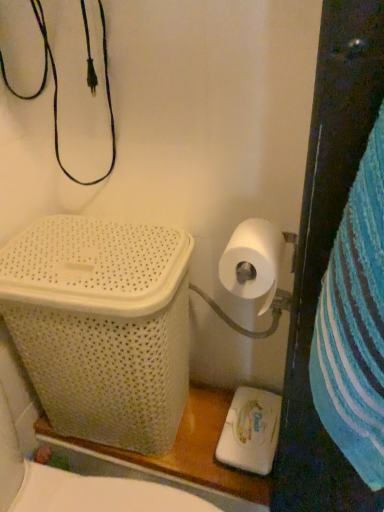
What is the approximate width of white woven laundry basket at left?

white woven laundry basket at left is 11.08 inches in width.

The height and width of the screenshot is (512, 384). What do you see at coordinates (102, 326) in the screenshot?
I see `white woven laundry basket at left` at bounding box center [102, 326].

What is the approximate height of white woven laundry basket at left?

white woven laundry basket at left is 20.69 inches tall.

You are a GUI agent. You are given a task and a screenshot of the screen. Output one action in this format:
    pyautogui.click(x=<x>, y=<y>)
    Task: Click on the white woven laundry basket at left
    
    Given the screenshot: What is the action you would take?
    pyautogui.click(x=102, y=326)

Describe the element at coordinates (253, 261) in the screenshot. I see `white matte toilet paper at right` at that location.

Identify the location of white matte toilet paper at right. (253, 261).

This screenshot has height=512, width=384. I want to click on white woven laundry basket at left, so coord(102,326).

Visually, is white matte toilet paper at right positioned to the left or to the right of white woven laundry basket at left?

From the image, it's evident that white matte toilet paper at right is to the right of white woven laundry basket at left.

Between white matte toilet paper at right and white woven laundry basket at left, which one is positioned in front?

white matte toilet paper at right.

Between point (257, 221) and point (5, 319), which one is positioned in front?

The point (257, 221) is in front.

From the image's perspective, is white matte toilet paper at right located beneath white woven laundry basket at left?

Actually, white matte toilet paper at right appears above white woven laundry basket at left in the image.

From a real-world perspective, is white matte toilet paper at right positioned over white woven laundry basket at left based on gravity?

Indeed, from a real-world perspective, white matte toilet paper at right stands above white woven laundry basket at left.

Is white matte toilet paper at right thinner than white woven laundry basket at left?

Correct, the width of white matte toilet paper at right is less than that of white woven laundry basket at left.

Is white matte toilet paper at right taller than white woven laundry basket at left?

No, white matte toilet paper at right is not taller than white woven laundry basket at left.

Who is bigger, white matte toilet paper at right or white woven laundry basket at left?

Bigger between the two is white woven laundry basket at left.

Is white woven laundry basket at left a part of white matte toilet paper at right?

That's incorrect, white woven laundry basket at left is not inside white matte toilet paper at right.

Is white matte toilet paper at right not close to white woven laundry basket at left?

No, white matte toilet paper at right is not far from white woven laundry basket at left.

Is white matte toilet paper at right facing towards white woven laundry basket at left?

No, white matte toilet paper at right does not turn towards white woven laundry basket at left.

Measure the distance between white matte toilet paper at right and white woven laundry basket at left.

white matte toilet paper at right is 12.48 inches away from white woven laundry basket at left.

The image size is (384, 512). In the image, there is a white matte toilet paper at right. Find the location of `laundry basket below it (from the image's perspective)`. laundry basket below it (from the image's perspective) is located at coordinates (102, 326).

Can you confirm if white woven laundry basket at left is positioned to the left of white matte toilet paper at right?

Yes.

Is the depth of white woven laundry basket at left greater than that of white matte toilet paper at right?

Yes, it is.

Which point is more forward, (177, 309) or (271, 232)?

The point (271, 232) is more forward.

From the image's perspective, relative to white matte toilet paper at right, is white woven laundry basket at left above or below?

From the image's perspective, white woven laundry basket at left appears below white matte toilet paper at right.

From a real-world perspective, is white woven laundry basket at left on top of white matte toilet paper at right?

Incorrect, from a real-world perspective, white woven laundry basket at left is lower than white matte toilet paper at right.

Does white woven laundry basket at left have a lesser width compared to white matte toilet paper at right?

Incorrect, the width of white woven laundry basket at left is not less than that of white matte toilet paper at right.

From the picture: Considering the sizes of objects white woven laundry basket at left and white matte toilet paper at right in the image provided, who is taller, white woven laundry basket at left or white matte toilet paper at right?

With more height is white woven laundry basket at left.

Based on the photo, considering the relative sizes of white woven laundry basket at left and white matte toilet paper at right in the image provided, is white woven laundry basket at left smaller than white matte toilet paper at right?

No, white woven laundry basket at left is not smaller than white matte toilet paper at right.

Is white matte toilet paper at right surrounded by white woven laundry basket at left?

No, white matte toilet paper at right is located outside of white woven laundry basket at left.

Is white woven laundry basket at left far from white matte toilet paper at right?

white woven laundry basket at left is actually quite close to white matte toilet paper at right.

Is white woven laundry basket at left looking in the opposite direction of white matte toilet paper at right?

No.

What's the angular difference between white woven laundry basket at left and white matte toilet paper at right's facing directions?

0.000374 degrees.

Measure the distance from white woven laundry basket at left to white matte toilet paper at right.

white woven laundry basket at left is 31.70 centimeters from white matte toilet paper at right.

The image size is (384, 512). I want to click on toilet paper that is on the right side of white woven laundry basket at left, so click(x=253, y=261).

The height and width of the screenshot is (512, 384). In order to click on toilet paper above the white woven laundry basket at left (from the image's perspective) in this screenshot , I will do `click(253, 261)`.

Identify the location of laundry basket located on the left of white matte toilet paper at right. Image resolution: width=384 pixels, height=512 pixels. (102, 326).